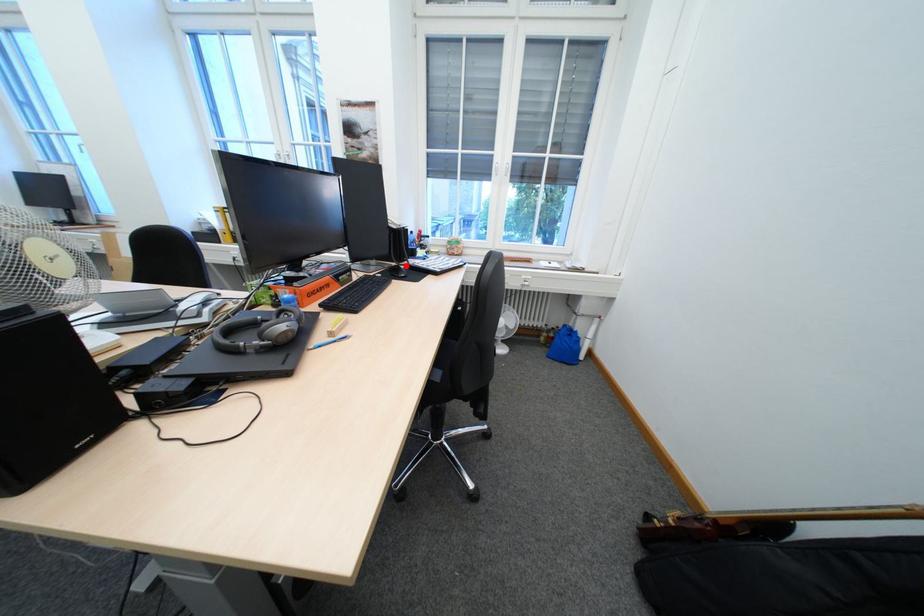
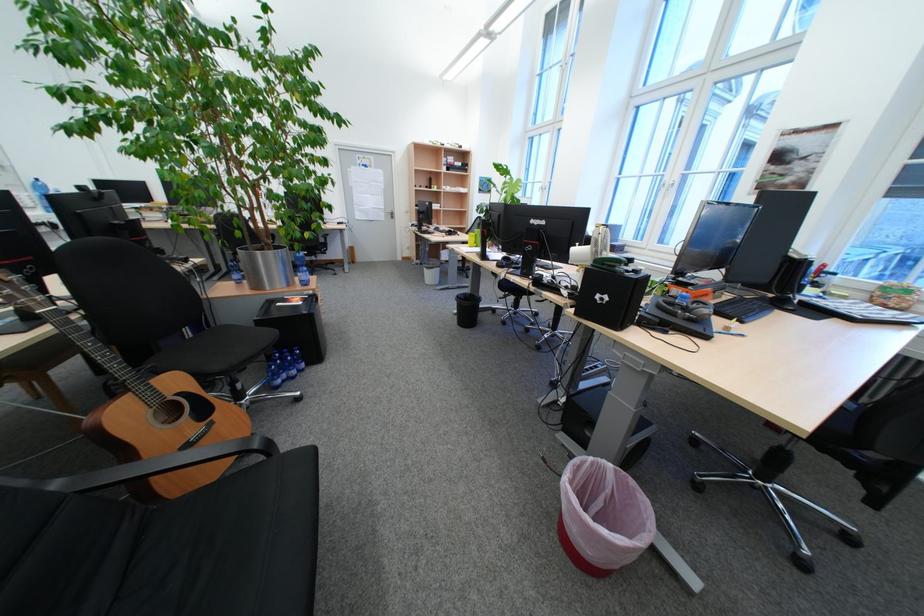
Find the pixel in the second image that matches the highlighted location in the first image.

(783, 297)